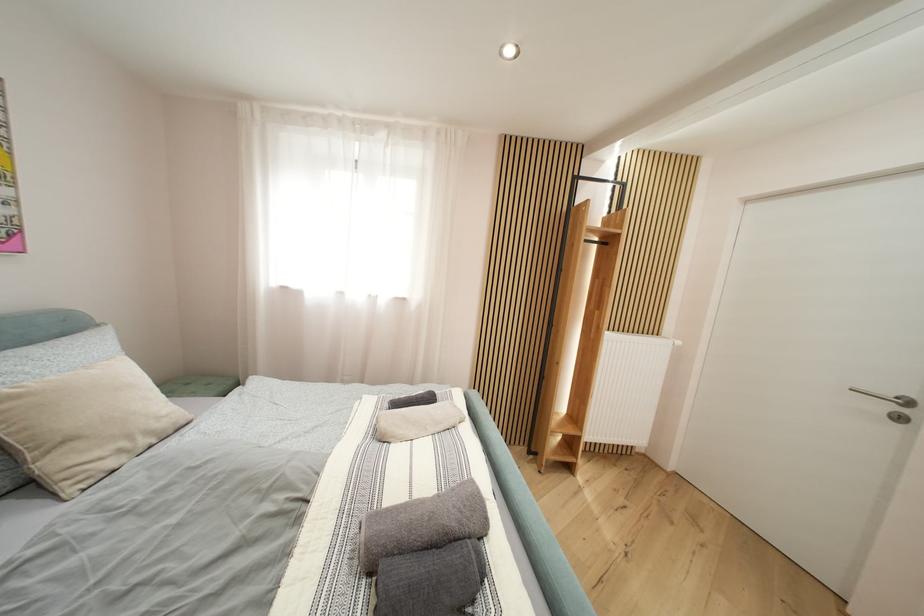
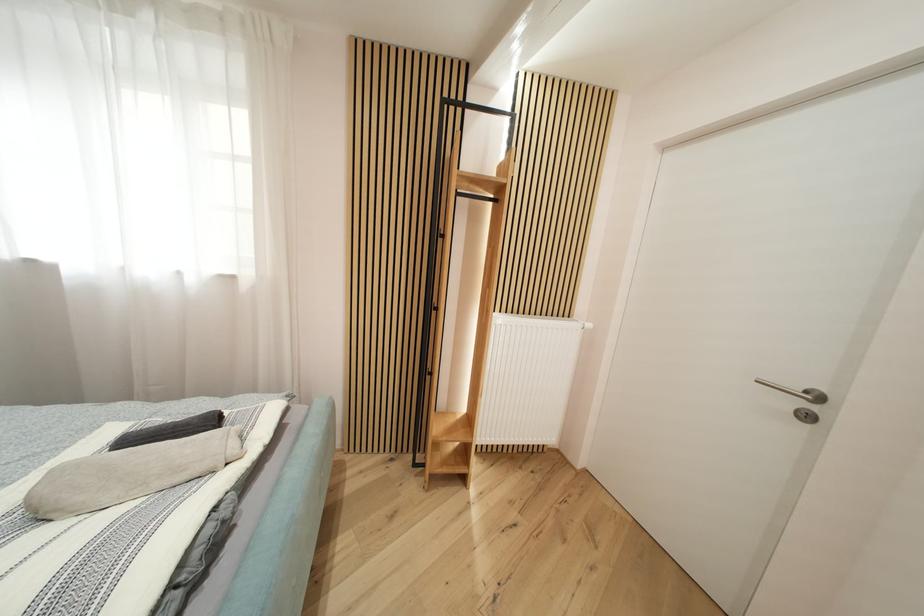
Which direction would the cameraman need to move to produce the second image?

The cameraman walked toward right, forward.